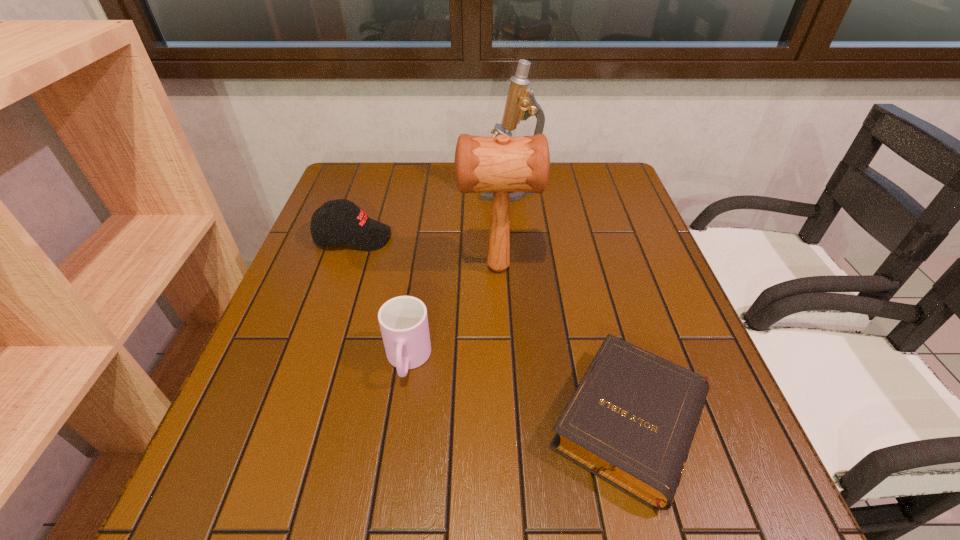
At what (x,y) coordinates should I click in order to perform the action: click on free space at the right edge. Please return your answer as a coordinate pair (x, y). Image resolution: width=960 pixels, height=540 pixels. Looking at the image, I should click on (617, 264).

You are a GUI agent. You are given a task and a screenshot of the screen. Output one action in this format:
    pyautogui.click(x=<x>, y=<y>)
    Task: Click on the vacant region at the far left corner of the desktop
    This screenshot has height=540, width=960.
    Given the screenshot: What is the action you would take?
    pyautogui.click(x=380, y=195)

In the image, there is a desktop. In order to click on vacant space at the near right corner in this screenshot , I will do pyautogui.click(x=713, y=508).

At what (x,y) coordinates should I click in order to perform the action: click on unoccupied position between the mallet and the leftmost object. Please return your answer as a coordinate pair (x, y). The width and height of the screenshot is (960, 540). Looking at the image, I should click on (425, 252).

This screenshot has width=960, height=540. Find the location of `unoccupied area between the leftmost object and the microscope`. unoccupied area between the leftmost object and the microscope is located at coordinates (431, 213).

Locate an element on the screen. empty space between the baseball cap and the second object from left to right is located at coordinates (380, 299).

Find the location of `free space between the mallet and the leftmost object`. free space between the mallet and the leftmost object is located at coordinates (425, 252).

You are a GUI agent. You are given a task and a screenshot of the screen. Output one action in this format:
    pyautogui.click(x=<x>, y=<y>)
    Task: Click on the unoccupied area between the farthest object and the Bible
    
    Given the screenshot: What is the action you would take?
    pyautogui.click(x=570, y=307)

Find the location of a particular element. The height and width of the screenshot is (540, 960). free spot between the shortest object and the microscope is located at coordinates (570, 307).

You are a GUI agent. You are given a task and a screenshot of the screen. Output one action in this format:
    pyautogui.click(x=<x>, y=<y>)
    Task: Click on the free space between the microscope and the shortest object
    The width and height of the screenshot is (960, 540).
    Given the screenshot: What is the action you would take?
    pyautogui.click(x=570, y=307)